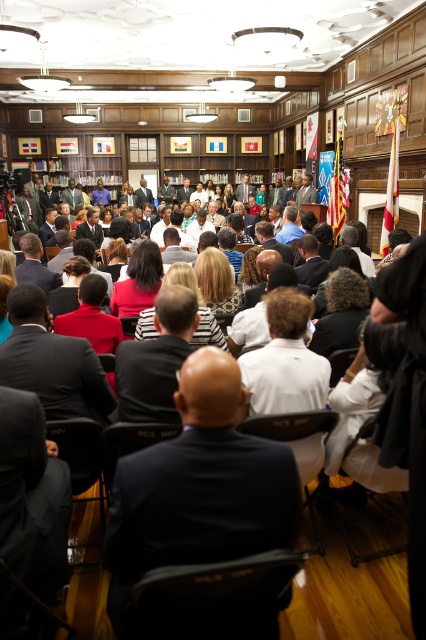
Between black suit at center and matte red dress at center, which one has more height?

Standing taller between the two is black suit at center.

Does black suit at center have a lesser width compared to matte red dress at center?

Yes, black suit at center is thinner than matte red dress at center.

Between point (192, 317) and point (112, 328), which one is positioned behind?

Positioned behind is point (112, 328).

Locate an element on the screen. black suit at center is located at coordinates (155, 360).

Is dark blue suit at center thinner than black suit at center?

No.

Who is more distant from viewer, (224, 460) or (176, 413)?

Point (176, 413)

I want to click on dark blue suit at center, so click(x=175, y=518).

Between point (186, 292) and point (155, 248), which one is positioned in front?

Point (186, 292) is more forward.

Looking at this image, between black suit at center and matte black jacket at center, which one appears on the right side from the viewer's perspective?

Positioned to the right is black suit at center.

Who is more forward, [166,323] or [138,285]?

Positioned in front is point [166,323].

Locate an element on the screen. black suit at center is located at coordinates (155, 360).